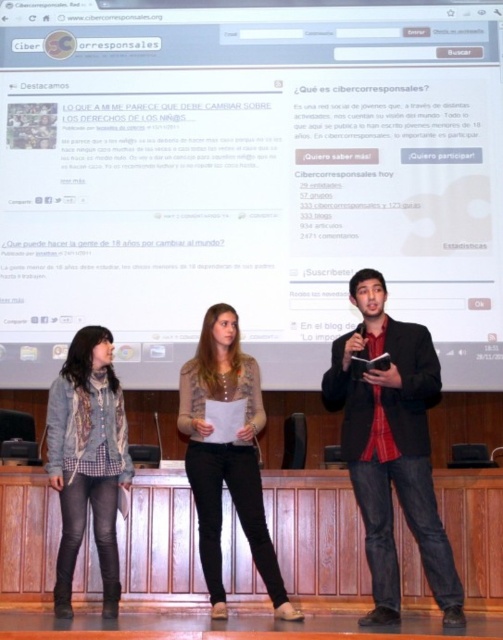
Question: Which object is positioned farthest from the white glossy projection screen at upper center?

Choices:
 (A) black jeans at center
 (B) denim jacket at lower left
 (C) matte black blazer at center

Answer: (C)

Question: Can you confirm if matte black blazer at center is positioned below black jeans at center?

Choices:
 (A) yes
 (B) no

Answer: (B)

Question: Is white glossy projection screen at upper center to the left of black jeans at center from the viewer's perspective?

Choices:
 (A) no
 (B) yes

Answer: (A)

Question: Which point is closer to the camera?

Choices:
 (A) denim jacket at lower left
 (B) white glossy projection screen at upper center
 (C) black jeans at center
 (D) matte black blazer at center

Answer: (D)

Question: Which point is closer to the camera taking this photo?

Choices:
 (A) (55, 353)
 (B) (267, 541)
 (C) (60, 557)

Answer: (C)

Question: Can you confirm if white glossy projection screen at upper center is bigger than denim jacket at lower left?

Choices:
 (A) no
 (B) yes

Answer: (B)